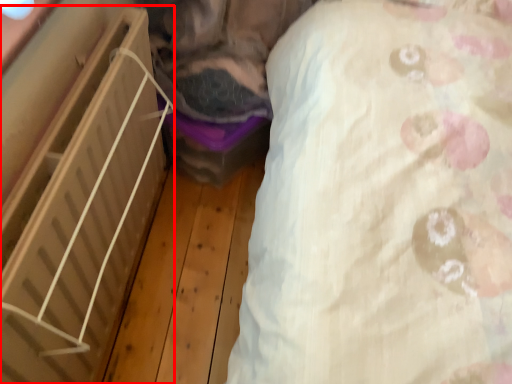
Question: From the image's perspective, considering the relative positions of furniture (annotated by the red box) and sheet in the image provided, where is furniture (annotated by the red box) located with respect to the staircase?

Choices:
 (A) above
 (B) below

Answer: (B)